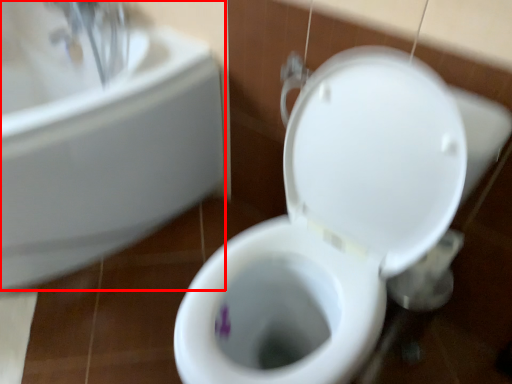
Question: From the image's perspective, where is sink (annotated by the red box) located relative to toilet?

Choices:
 (A) above
 (B) below

Answer: (A)